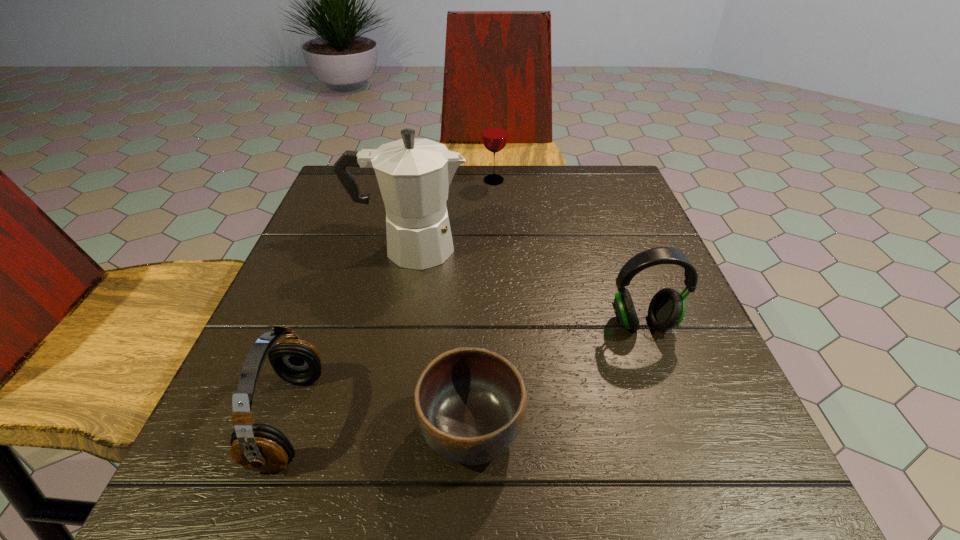
At what (x,y) coordinates should I click in order to perform the action: click on free space located 0.320m on the ear cups of the nearer headset. Please return your answer as a coordinate pair (x, y). Looking at the image, I should click on (x=532, y=419).

Find the location of a particular element. The width and height of the screenshot is (960, 540). free space located 0.130m on the right of the bowl is located at coordinates (613, 430).

The height and width of the screenshot is (540, 960). What are the coordinates of `object that is positioned at the far edge` in the screenshot? It's located at (494, 136).

This screenshot has width=960, height=540. Find the location of `headset situated at the near edge`. headset situated at the near edge is located at coordinates (258, 447).

You are a GUI agent. You are given a task and a screenshot of the screen. Output one action in this format:
    pyautogui.click(x=<x>, y=<y>)
    Task: Click on the bowl that is at the near edge
    The width and height of the screenshot is (960, 540).
    Given the screenshot: What is the action you would take?
    pyautogui.click(x=470, y=403)

Identify the location of coffeepot situated at the left edge. pos(414,175).

This screenshot has height=540, width=960. Find the location of `headset present at the left edge`. headset present at the left edge is located at coordinates (258, 447).

Identify the location of object that is at the right edge. (666, 311).

The width and height of the screenshot is (960, 540). What are the coordinates of `object that is at the near left corner` in the screenshot? It's located at (258, 447).

I want to click on vacant space at the far edge of the desktop, so click(x=564, y=185).